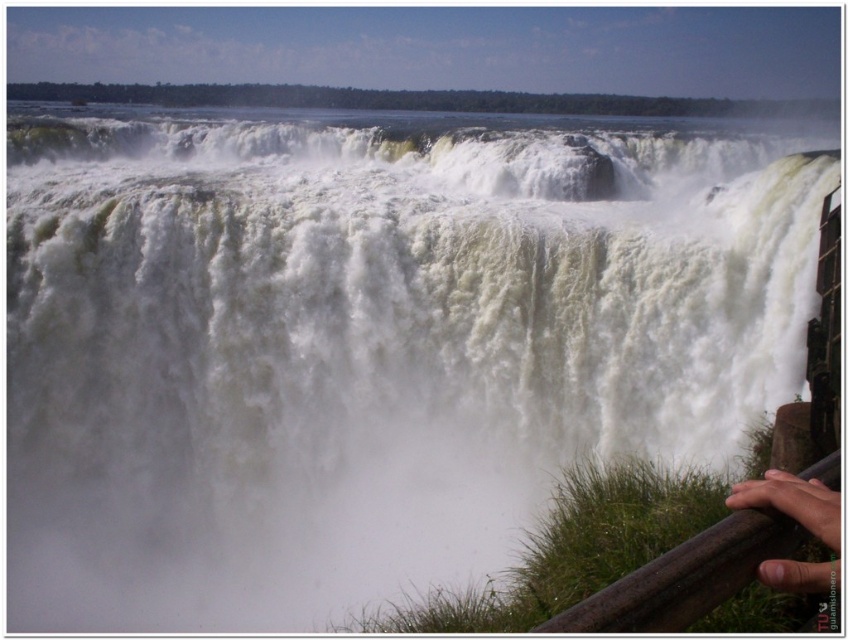
You are standing at the edge of the waterfall and want to take a photo of the brown wooden rail at lower right and the skinny flesh at lower right. Which object is wider in the photo?

The brown wooden rail at lower right is wider than the skinny flesh at lower right in the photo because the brown wooden rail at lower right has a greater width compared to the skinny flesh at lower right.

Based on the photo, you are standing at the viewing platform and want to take a photo of the waterfall. To ensure both the brown wooden rail at lower right and the skinny flesh at lower right are in the frame, which object should you position closer to the center?

You should position the brown wooden rail at lower right closer to the center because it is to the left of the skinny flesh at lower right, so centering the rail would keep both in the frame.

You are standing at the viewing platform and want to place your backpack on the brown wooden rail at lower right. Given that the rail is at coordinate point 0.903, 0.809 in the image, can you determine if the backpack will fit on the rail?

The brown wooden rail at lower right is located at coordinate point (x=685, y=577), but without knowing the dimensions of the backpack or the rail, it is impossible to determine if it will fit.